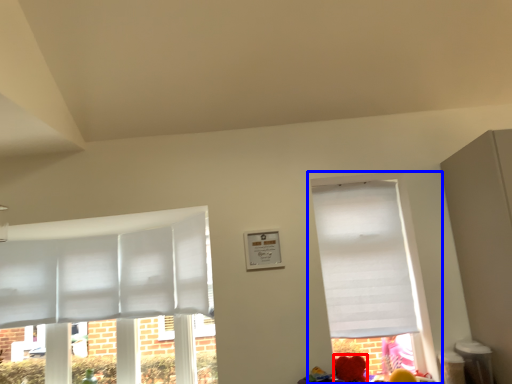
Question: Among these objects, which one is farthest to the camera, flower (highlighted by a red box) or window (highlighted by a blue box)?

Choices:
 (A) flower
 (B) window

Answer: (B)